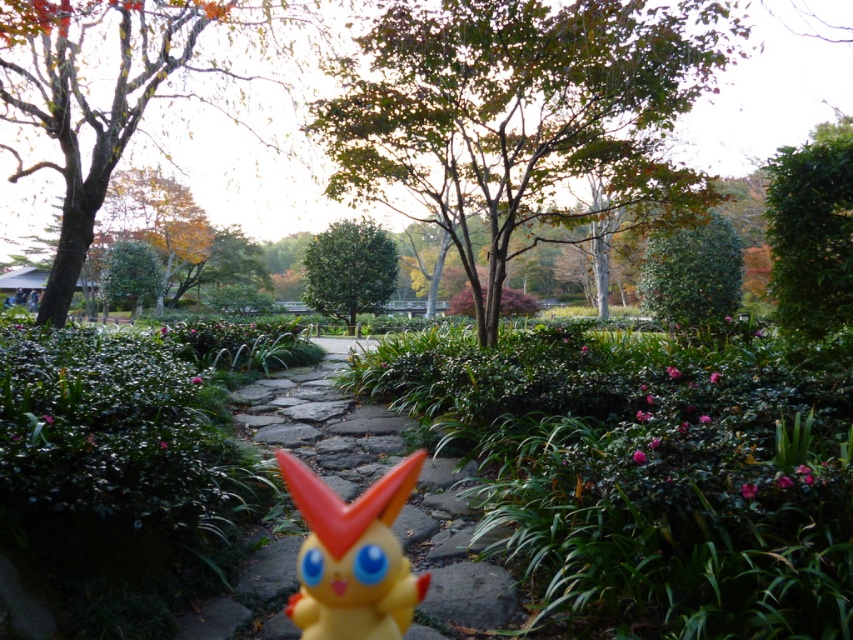
Question: Can you confirm if brown wood tree at upper left is positioned above smooth stone path at center?

Choices:
 (A) no
 (B) yes

Answer: (B)

Question: Which point appears closest to the camera in this image?

Choices:
 (A) (422, 474)
 (B) (672, 230)

Answer: (A)

Question: Based on their relative distances, which object is farther from the green leafy bush at upper right?

Choices:
 (A) green matte tree at center
 (B) green leafy tree at center

Answer: (A)

Question: Is green leafy tree at center below smooth stone path at center?

Choices:
 (A) yes
 (B) no

Answer: (B)

Question: Which of the following is the closest to the observer?

Choices:
 (A) yellow plastic toy at center
 (B) green leafy bush at upper right

Answer: (A)

Question: Does brown wood tree at upper left have a greater width compared to green leafy tree at upper right?

Choices:
 (A) no
 (B) yes

Answer: (A)